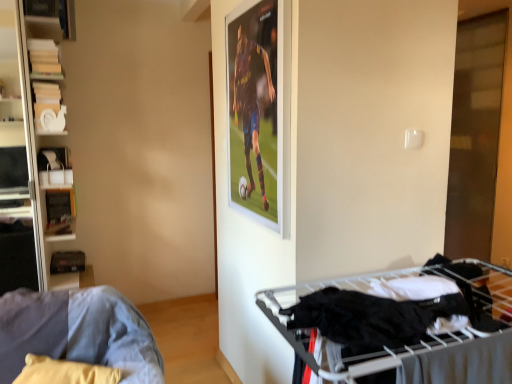
Identify the location of transparent glass door at right. (476, 133).

At what (x,y) coordinates should I click in order to perform the action: click on denim fabric couch at lower left. Please return your answer as a coordinate pair (x, y). The height and width of the screenshot is (384, 512). Looking at the image, I should click on (78, 332).

Is transparent glass door at right in contact with black fabric at lower right?

No, transparent glass door at right is not beside black fabric at lower right.

Which of these two, transparent glass door at right or black fabric at lower right, is bigger?

transparent glass door at right.

At what (x,y) coordinates should I click in order to perform the action: click on bunk bed that appears on the left of transparent glass door at right. Please return your answer as a coordinate pair (x, y). The image size is (512, 384). Looking at the image, I should click on (399, 322).

Is black fabric at lower right at the back of transparent glass door at right?

That's not correct — transparent glass door at right is not looking away from black fabric at lower right.

Is point (64, 301) positioned before point (33, 160)?

Yes, it is in front of point (33, 160).

Where is `furniture in front of the white matte bookshelf at left`? This screenshot has height=384, width=512. furniture in front of the white matte bookshelf at left is located at coordinates (78, 332).

From a real-world perspective, relative to white matte bookshelf at left, is denim fabric couch at lower left vertically above or below?

Clearly, from a real-world perspective, denim fabric couch at lower left is below white matte bookshelf at left.

Considering the sizes of objects denim fabric couch at lower left and white matte bookshelf at left in the image provided, who is wider, denim fabric couch at lower left or white matte bookshelf at left?

denim fabric couch at lower left.

Which of these two, denim fabric couch at lower left or black fabric at lower right, is wider?

denim fabric couch at lower left is wider.

Does denim fabric couch at lower left have a lesser height compared to black fabric at lower right?

In fact, denim fabric couch at lower left may be taller than black fabric at lower right.

Can you tell me how much denim fabric couch at lower left and black fabric at lower right differ in facing direction?

denim fabric couch at lower left and black fabric at lower right are facing 37.3 degrees away from each other.

From a real-world perspective, is denim fabric couch at lower left on top of black fabric at lower right?

No, from a real-world perspective, denim fabric couch at lower left is not over black fabric at lower right

Based on the photo, from the image's perspective, would you say white matte bookshelf at left is positioned over black fabric at lower right?

Yes.

Locate an element on the screen. The height and width of the screenshot is (384, 512). bunk bed that appears in front of the white matte bookshelf at left is located at coordinates click(399, 322).

Which is in front, point (35, 182) or point (404, 333)?

Point (404, 333)

How different are the orientations of black fabric at lower right and transparent glass door at right in degrees?

92 degrees separate the facing orientations of black fabric at lower right and transparent glass door at right.

Does point (506, 320) appear closer or farther from the camera than point (482, 208)?

Point (506, 320) is positioned closer to the camera compared to point (482, 208).

Looking at this image, does black fabric at lower right appear on the right side of transparent glass door at right?

In fact, black fabric at lower right is to the left of transparent glass door at right.

This screenshot has width=512, height=384. Identify the location of glass door on the right of black fabric at lower right. (476, 133).

Considering the sizes of objects white matte bookshelf at left and transparent glass door at right in the image provided, who is wider, white matte bookshelf at left or transparent glass door at right?

Wider between the two is white matte bookshelf at left.

Is point (32, 27) closer or farther from the camera than point (496, 171)?

Point (32, 27) is closer to the camera than point (496, 171).

Are white matte bookshelf at left and transparent glass door at right located far from each other?

white matte bookshelf at left is positioned a significant distance from transparent glass door at right.

From a real-world perspective, is white matte bookshelf at left under transparent glass door at right?

Yes, from a real-world perspective, white matte bookshelf at left is beneath transparent glass door at right.

How many degrees apart are the facing directions of transparent glass door at right and white matte bookshelf at left?

There is a 179-degree angle between the facing directions of transparent glass door at right and white matte bookshelf at left.

Is transparent glass door at right facing towards white matte bookshelf at left?

Yes, transparent glass door at right is turned towards white matte bookshelf at left.

Does transparent glass door at right have a larger size compared to white matte bookshelf at left?

Yes.

Considering the positions of point (475, 142) and point (22, 96), is point (475, 142) closer or farther from the camera than point (22, 96)?

Point (475, 142).

Where is `bunk bed on the left of transparent glass door at right`? bunk bed on the left of transparent glass door at right is located at coordinates (399, 322).

Locate an element on the screen. The height and width of the screenshot is (384, 512). furniture that is below the white matte bookshelf at left (from the image's perspective) is located at coordinates (78, 332).

When comparing their distances from black fabric at lower right, does denim fabric couch at lower left or transparent glass door at right seem further?

transparent glass door at right is positioned further to the anchor black fabric at lower right.

Considering their positions, is black fabric at lower right positioned closer to transparent glass door at right than denim fabric couch at lower left?

black fabric at lower right.

Looking at the image, which one is located further to black fabric at lower right, white matte bookshelf at left or transparent glass door at right?

transparent glass door at right lies further to black fabric at lower right than the other object.

Looking at the image, which one is located further to transparent glass door at right, black fabric at lower right or white matte bookshelf at left?

The object further to transparent glass door at right is white matte bookshelf at left.

From the image, which object appears to be farther from black fabric at lower right, transparent glass door at right or denim fabric couch at lower left?

transparent glass door at right.

Which object lies nearer to the anchor point white matte bookshelf at left, transparent glass door at right or denim fabric couch at lower left?

Among the two, denim fabric couch at lower left is located nearer to white matte bookshelf at left.

From the image, which object appears to be farther from transparent glass door at right, white matte bookshelf at left or black fabric at lower right?

white matte bookshelf at left is further to transparent glass door at right.

Looking at the image, which one is located further to transparent glass door at right, white matte bookshelf at left or denim fabric couch at lower left?

Based on the image, denim fabric couch at lower left appears to be further to transparent glass door at right.

Locate an element on the screen. The height and width of the screenshot is (384, 512). furniture between white matte bookshelf at left and black fabric at lower right is located at coordinates (78, 332).

Locate an element on the screen. The height and width of the screenshot is (384, 512). furniture situated between white matte bookshelf at left and transparent glass door at right from left to right is located at coordinates (78, 332).

Locate an element on the screen. This screenshot has width=512, height=384. bunk bed between white matte bookshelf at left and transparent glass door at right in the horizontal direction is located at coordinates (399, 322).

Where is `furniture positioned between black fabric at lower right and transparent glass door at right from near to far`? Image resolution: width=512 pixels, height=384 pixels. furniture positioned between black fabric at lower right and transparent glass door at right from near to far is located at coordinates (78, 332).